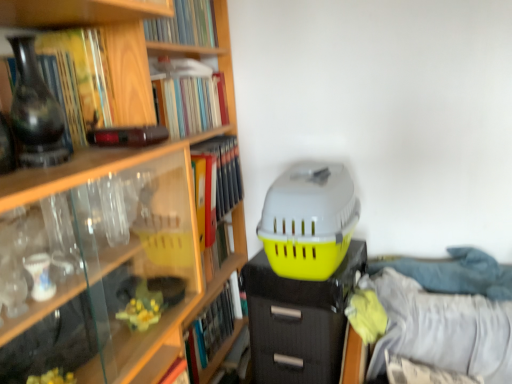
The height and width of the screenshot is (384, 512). I want to click on wooden bookshelf at upper left, marked as the second book in a bottom-to-top arrangement, so click(x=109, y=249).

What is the approximate width of wooden bookshelf at upper left, marked as the second book in a bottom-to-top arrangement?

It is 9.15 inches.

Measure the distance between hardcover book at upper center, arranged as the 1th book when viewed from the top, and camera.

A distance of 1.29 meters exists between hardcover book at upper center, arranged as the 1th book when viewed from the top, and camera.

What do you see at coordinates (35, 111) in the screenshot?
I see `matte black vase at left` at bounding box center [35, 111].

At what (x,y) coordinates should I click in order to perform the action: click on wooden bookshelf at upper left, marked as the second book in a bottom-to-top arrangement. Please return your answer as a coordinate pair (x, y). Looking at the image, I should click on (109, 249).

From the image's perspective, is matte black vase at left below matte black file cabinet at center?

Actually, matte black vase at left appears above matte black file cabinet at center in the image.

Which is more distant, (34, 112) or (335, 369)?

The point (335, 369) is farther from the camera.

How many degrees apart are the facing directions of matte black vase at left and matte black file cabinet at center?

The angular difference between matte black vase at left and matte black file cabinet at center is 89.4 degrees.

Which object is thinner, hardcover book at upper center, the 6th book positioned from the bottom, or wooden bookshelf at upper left, which is counted as the fifth book, starting from the top?

With smaller width is hardcover book at upper center, the 6th book positioned from the bottom.

I want to click on book that is the 4th one when counting downward from the hardcover book at upper center, arranged as the 1th book when viewed from the top (from the image's perspective), so click(x=109, y=249).

Measure the distance between hardcover book at upper center, arranged as the 1th book when viewed from the top, and wooden bookshelf at upper left, which is counted as the fifth book, starting from the top.

They are 25.44 inches apart.

Is hardcover book at upper center, arranged as the 1th book when viewed from the top, with wooden bookshelf at upper left, marked as the second book in a bottom-to-top arrangement?

No, hardcover book at upper center, arranged as the 1th book when viewed from the top, is not touching wooden bookshelf at upper left, marked as the second book in a bottom-to-top arrangement.

How much distance is there between yellow matte file folder at upper center, placed as the 4th book when sorted from top to bottom, and matte black book at upper left, which is the 4th book from bottom to top?

yellow matte file folder at upper center, placed as the 4th book when sorted from top to bottom, and matte black book at upper left, which is the 4th book from bottom to top, are 20.50 inches apart from each other.

Considering the sizes of yellow matte file folder at upper center, acting as the 3th book starting from the bottom, and matte black book at upper left, which is the 4th book from bottom to top, in the image, is yellow matte file folder at upper center, acting as the 3th book starting from the bottom, wider or thinner than matte black book at upper left, which is the 4th book from bottom to top,?

yellow matte file folder at upper center, acting as the 3th book starting from the bottom, is thinner than matte black book at upper left, which is the 4th book from bottom to top.

Is point (234, 153) positioned before point (36, 49)?

No.

Consider the image. Is yellow matte file folder at upper center, placed as the 4th book when sorted from top to bottom, with hardcover book at upper center, arranged as the 1th book when viewed from the top?

No, yellow matte file folder at upper center, placed as the 4th book when sorted from top to bottom, is not making contact with hardcover book at upper center, arranged as the 1th book when viewed from the top.

Does point (218, 220) appear closer or farther from the camera than point (208, 22)?

Point (218, 220) is closer to the camera than point (208, 22).

Would you say yellow matte file folder at upper center, acting as the 3th book starting from the bottom, is inside or outside hardcover book at upper center, arranged as the 1th book when viewed from the top?

The correct answer is: outside.

Who is smaller, yellow matte file folder at upper center, placed as the 4th book when sorted from top to bottom, or hardcover book at upper center, the 6th book positioned from the bottom?

yellow matte file folder at upper center, placed as the 4th book when sorted from top to bottom.

From a real-world perspective, who is located lower, wooden bookshelf at upper left, marked as the second book in a bottom-to-top arrangement, or yellow matte file folder at upper center, acting as the 3th book starting from the bottom?

wooden bookshelf at upper left, marked as the second book in a bottom-to-top arrangement, is physically lower.

Is yellow matte file folder at upper center, acting as the 3th book starting from the bottom, inside wooden bookshelf at upper left, marked as the second book in a bottom-to-top arrangement?

Yes, yellow matte file folder at upper center, acting as the 3th book starting from the bottom, is inside wooden bookshelf at upper left, marked as the second book in a bottom-to-top arrangement.

Considering the relative positions of wooden bookshelf at upper left, marked as the second book in a bottom-to-top arrangement, and yellow matte file folder at upper center, acting as the 3th book starting from the bottom, in the image provided, is wooden bookshelf at upper left, marked as the second book in a bottom-to-top arrangement, behind yellow matte file folder at upper center, acting as the 3th book starting from the bottom,?

No, wooden bookshelf at upper left, marked as the second book in a bottom-to-top arrangement, is closer to the viewer.

Locate an element on the screen. book that is the 3rd one when counting forward from the hardcover book at upper center, the fifth book ordered from the bottom is located at coordinates (77, 80).

Is hardcover book at upper center, the fifth book ordered from the bottom, behind matte black book at upper left, which is the 4th book from bottom to top?

Yes, it is.

Measure the distance between hardcover book at upper center, which is the 2th book from top to bottom, and matte black book at upper left, the 3th book from the top.

A distance of 17.88 inches exists between hardcover book at upper center, which is the 2th book from top to bottom, and matte black book at upper left, the 3th book from the top.

How different are the orientations of hardcover book at upper center, the fifth book ordered from the bottom, and matte black book at upper left, the 3th book from the top, in degrees?

hardcover book at upper center, the fifth book ordered from the bottom, and matte black book at upper left, the 3th book from the top, are facing 1.52 degrees away from each other.

Is matte black vase at left positioned behind yellow matte file folder at upper center, placed as the 4th book when sorted from top to bottom?

No, the depth of matte black vase at left is less than that of yellow matte file folder at upper center, placed as the 4th book when sorted from top to bottom.

In terms of width, does matte black vase at left look wider or thinner when compared to yellow matte file folder at upper center, placed as the 4th book when sorted from top to bottom?

Considering their sizes, matte black vase at left looks slimmer than yellow matte file folder at upper center, placed as the 4th book when sorted from top to bottom.

Which object is positioned more to the left, matte black vase at left or yellow matte file folder at upper center, acting as the 3th book starting from the bottom?

From the viewer's perspective, matte black vase at left appears more on the left side.

Can you see matte black vase at left touching yellow matte file folder at upper center, placed as the 4th book when sorted from top to bottom?

No, matte black vase at left is not next to yellow matte file folder at upper center, placed as the 4th book when sorted from top to bottom.

The width and height of the screenshot is (512, 384). In the image, there is a matte black vase at left. Find the location of `file cabinet below it (from the image's perspective)`. file cabinet below it (from the image's perspective) is located at coordinates (298, 320).

From the wooden bookshelf at upper left, marked as the second book in a bottom-to-top arrangement, count 1st books backward and point to it. Please provide its 2D coordinates.

[(185, 25)]

Which object lies nearer to the anchor point hardcover book at lower left, which is the first book in bottom-to-top order, wooden bookshelf at upper left, marked as the second book in a bottom-to-top arrangement, or matte black file cabinet at center?

matte black file cabinet at center lies closer to hardcover book at lower left, which is the first book in bottom-to-top order, than the other object.

From the picture: Looking at the image, which one is located closer to yellow matte file folder at upper center, placed as the 4th book when sorted from top to bottom, matte black book at upper left, the 3th book from the top, or matte black vase at left?

matte black book at upper left, the 3th book from the top, is closer to yellow matte file folder at upper center, placed as the 4th book when sorted from top to bottom.

Based on their spatial positions, is hardcover book at lower left, marked as the 6th book in a top-to-bottom arrangement, or hardcover book at upper center, the 6th book positioned from the bottom, closer to hardcover book at upper center, which is the 2th book from top to bottom?

hardcover book at upper center, the 6th book positioned from the bottom, is positioned closer to the anchor hardcover book at upper center, which is the 2th book from top to bottom.

Estimate the real-world distances between objects in this image. Which object is further from hardcover book at upper center, the fifth book ordered from the bottom, hardcover book at upper center, arranged as the 1th book when viewed from the top, or hardcover book at lower left, marked as the 6th book in a top-to-bottom arrangement?

Among the two, hardcover book at lower left, marked as the 6th book in a top-to-bottom arrangement, is located further to hardcover book at upper center, the fifth book ordered from the bottom.

Based on their spatial positions, is wooden bookshelf at upper left, marked as the second book in a bottom-to-top arrangement, or hardcover book at upper center, arranged as the 1th book when viewed from the top, further from matte black file cabinet at center?

The object further to matte black file cabinet at center is hardcover book at upper center, arranged as the 1th book when viewed from the top.

Looking at the image, which one is located further to wooden bookshelf at upper left, which is counted as the fifth book, starting from the top, matte black vase at left or hardcover book at upper center, arranged as the 1th book when viewed from the top?

hardcover book at upper center, arranged as the 1th book when viewed from the top, lies further to wooden bookshelf at upper left, which is counted as the fifth book, starting from the top, than the other object.

From the image, which object appears to be nearer to matte black book at upper left, the 3th book from the top, hardcover book at upper center, the fifth book ordered from the bottom, or yellow matte file folder at upper center, placed as the 4th book when sorted from top to bottom?

Among the two, hardcover book at upper center, the fifth book ordered from the bottom, is located nearer to matte black book at upper left, the 3th book from the top.

From the image, which object appears to be farther from matte black vase at left, matte black file cabinet at center or wooden bookshelf at upper left, marked as the second book in a bottom-to-top arrangement?

The object further to matte black vase at left is matte black file cabinet at center.

Where is `vase between matte black book at upper left, the 3th book from the top, and hardcover book at lower left, which is the first book in bottom-to-top order, in the up-down direction`? The height and width of the screenshot is (384, 512). vase between matte black book at upper left, the 3th book from the top, and hardcover book at lower left, which is the first book in bottom-to-top order, in the up-down direction is located at coordinates (35, 111).

The width and height of the screenshot is (512, 384). I want to click on vase between matte black book at upper left, which is the 4th book from bottom to top, and matte black file cabinet at center vertically, so click(x=35, y=111).

Identify the location of vase between hardcover book at upper center, arranged as the 1th book when viewed from the top, and wooden bookshelf at upper left, which is counted as the fifth book, starting from the top, from top to bottom. The height and width of the screenshot is (384, 512). (35, 111).

Identify the location of book between yellow matte file folder at upper center, placed as the 4th book when sorted from top to bottom, and hardcover book at lower left, marked as the 6th book in a top-to-bottom arrangement, in the vertical direction. The width and height of the screenshot is (512, 384). (109, 249).